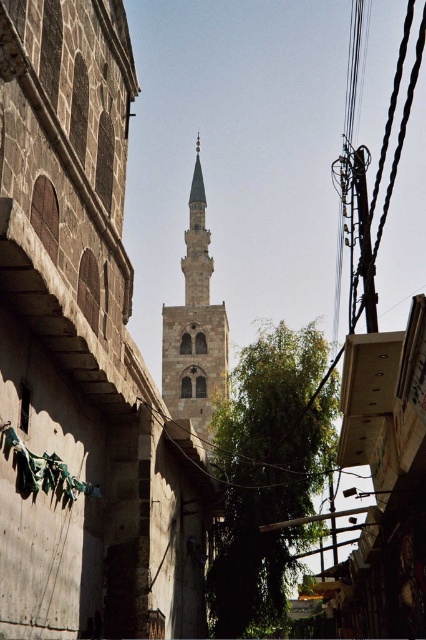
From the picture: You are standing at the entrance of the alleyway and see the stone minaret at center and the smooth white minaret at center. Which one is more to the right?

The stone minaret at center is positioned on the right side of smooth white minaret at center, so it is more to the right.

You are a delivery drone that is 1.2 meters wide. You need to fly through the narrow alleyway to deliver a package to the brown stone minaret at center. Can you fit through the narrowest part of the alleyway? Please explain your reasoning based on the minaret dimensions.

The brown stone minaret at center is narrower than the stone minaret at center. However, since both are the same minaret, this might be an error. Assuming the description intended to compare the alleyway width with the drone, but without specific measurements, it is unclear. The question cannot be accurately answered with the provided information.